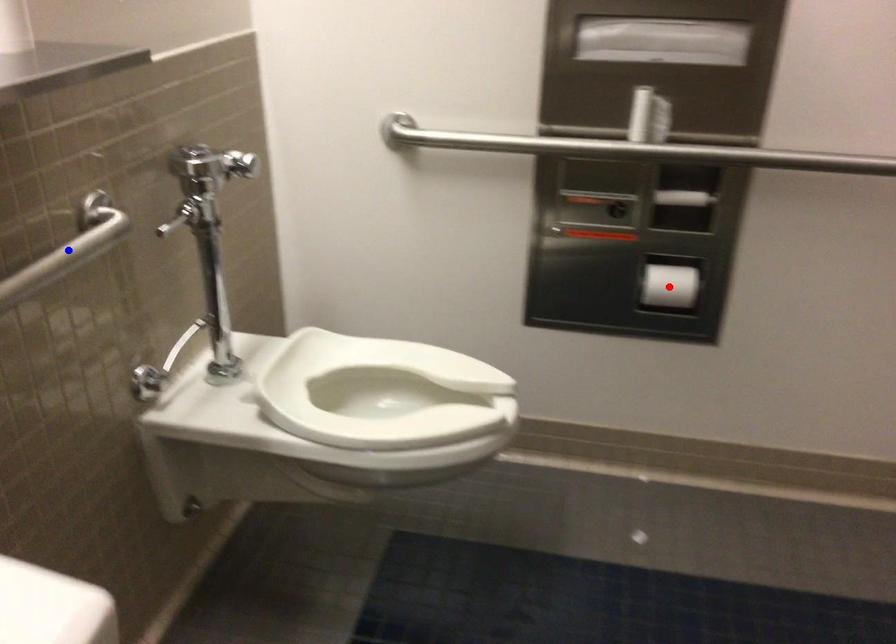
Question: In the image, two points are highlighted. Which point is nearer to the camera? Reply with the corresponding letter.

Choices:
 (A) blue point
 (B) red point

Answer: (A)